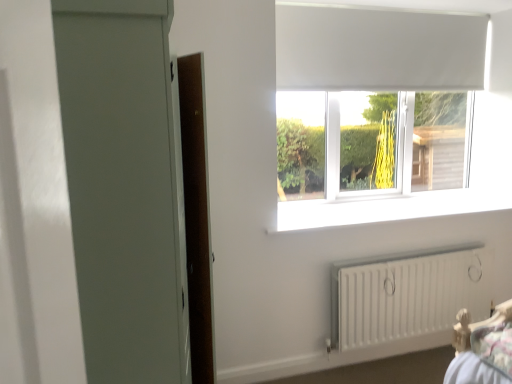
What do you see at coordinates (407, 295) in the screenshot?
I see `white matte radiator at lower right` at bounding box center [407, 295].

Describe the element at coordinates (378, 49) in the screenshot. I see `white matte curtain at upper center` at that location.

This screenshot has height=384, width=512. What do you see at coordinates (389, 208) in the screenshot? I see `white smooth window sill at center` at bounding box center [389, 208].

Where is `matte gray screen door at left`? The image size is (512, 384). matte gray screen door at left is located at coordinates (123, 187).

From a real-world perspective, does white matte curtain at upper center sit lower than matte gray screen door at left?

No, from a real-world perspective, white matte curtain at upper center is not below matte gray screen door at left.

Measure the distance from white matte curtain at upper center to matte gray screen door at left.

1.85 meters.

Find the location of a particular element. This screenshot has width=512, height=384. screen door on the left of the white matte curtain at upper center is located at coordinates (123, 187).

Between matte gray screen door at left and white matte radiator at lower right, which one has smaller width?

white matte radiator at lower right is thinner.

Is matte gray screen door at left to the left or to the right of white matte radiator at lower right in the image?

Based on their positions, matte gray screen door at left is located to the left of white matte radiator at lower right.

Can you tell me how much matte gray screen door at left and white matte radiator at lower right differ in facing direction?

matte gray screen door at left and white matte radiator at lower right are facing 88.4 degrees away from each other.

Are matte gray screen door at left and white matte radiator at lower right located far from each other?

matte gray screen door at left is far away from white matte radiator at lower right.

Which object is closer to the camera, white matte window at upper center or white smooth window sill at center?

→ white smooth window sill at center is closer to the camera.

The height and width of the screenshot is (384, 512). What are the coordinates of `window sill that appears in front of the white matte window at upper center` in the screenshot? It's located at (389, 208).

Based on their positions, is white matte window at upper center located to the left or right of white smooth window sill at center?

From the image, it's evident that white matte window at upper center is to the left of white smooth window sill at center.

Between matte gray screen door at left and white smooth window sill at center, which one appears on the left side from the viewer's perspective?

Positioned to the left is matte gray screen door at left.

Considering the relative sizes of matte gray screen door at left and white smooth window sill at center in the image provided, is matte gray screen door at left thinner than white smooth window sill at center?

Incorrect, the width of matte gray screen door at left is not less than that of white smooth window sill at center.

Between matte gray screen door at left and white smooth window sill at center, which one has smaller size?

white smooth window sill at center is smaller.

From the image's perspective, between matte gray screen door at left and white smooth window sill at center, who is located below?

matte gray screen door at left, from the image's perspective.

The width and height of the screenshot is (512, 384). I want to click on window sill on the right side of white matte window at upper center, so click(x=389, y=208).

From the image's perspective, between white smooth window sill at center and white matte window at upper center, who is located below?

white smooth window sill at center is shown below in the image.

Is white smooth window sill at center in contact with white matte window at upper center?

No.

Can you confirm if white smooth window sill at center is thinner than white matte window at upper center?

No.

Is white matte radiator at lower right facing away from matte gray screen door at left?

No, matte gray screen door at left is not at the back of white matte radiator at lower right.

Is white matte radiator at lower right next to matte gray screen door at left and touching it?

They are not placed beside each other.

Considering the sizes of white matte radiator at lower right and matte gray screen door at left in the image, is white matte radiator at lower right wider or thinner than matte gray screen door at left?

white matte radiator at lower right is thinner than matte gray screen door at left.

Visually, is white matte curtain at upper center positioned to the left or to the right of white matte window at upper center?

white matte curtain at upper center is positioned on white matte window at upper center's right side.

Can you see white matte curtain at upper center touching white matte window at upper center?

white matte curtain at upper center is not next to white matte window at upper center, and they're not touching.

Based on the photo, does white matte curtain at upper center have a greater width compared to white matte window at upper center?

Yes, white matte curtain at upper center is wider than white matte window at upper center.

In order to click on curtain on the right of the matte gray screen door at left in this screenshot , I will do `click(378, 49)`.

Image resolution: width=512 pixels, height=384 pixels. In order to click on screen door in front of the white matte radiator at lower right in this screenshot , I will do `click(123, 187)`.

From the picture: Estimate the real-world distances between objects in this image. Which object is further from matte gray screen door at left, white matte window at upper center or white matte radiator at lower right?

white matte window at upper center is positioned further to the anchor matte gray screen door at left.

Estimate the real-world distances between objects in this image. Which object is further from white smooth window sill at center, matte gray screen door at left or white matte window at upper center?

The object further to white smooth window sill at center is matte gray screen door at left.

Based on their spatial positions, is white smooth window sill at center or white matte curtain at upper center further from matte gray screen door at left?

white matte curtain at upper center is further to matte gray screen door at left.

Estimate the real-world distances between objects in this image. Which object is closer to white matte curtain at upper center, white smooth window sill at center or white matte window at upper center?

Among the two, white matte window at upper center is located nearer to white matte curtain at upper center.

Estimate the real-world distances between objects in this image. Which object is closer to white matte radiator at lower right, white matte window at upper center or matte gray screen door at left?

Based on the image, white matte window at upper center appears to be nearer to white matte radiator at lower right.

Considering their positions, is white matte curtain at upper center positioned closer to matte gray screen door at left than white smooth window sill at center?

white smooth window sill at center is positioned closer to the anchor matte gray screen door at left.

Looking at the image, which one is located closer to white smooth window sill at center, matte gray screen door at left or white matte curtain at upper center?

Among the two, white matte curtain at upper center is located nearer to white smooth window sill at center.

Which object lies nearer to the anchor point white smooth window sill at center, white matte window at upper center or white matte curtain at upper center?

white matte window at upper center lies closer to white smooth window sill at center than the other object.

Where is `radiator between matte gray screen door at left and white matte curtain at upper center from front to back`? The height and width of the screenshot is (384, 512). radiator between matte gray screen door at left and white matte curtain at upper center from front to back is located at coordinates (407, 295).

Image resolution: width=512 pixels, height=384 pixels. What are the coordinates of `window sill between white matte curtain at upper center and white matte radiator at lower right vertically` in the screenshot? It's located at (389, 208).

What are the coordinates of `window sill positioned between matte gray screen door at left and white matte curtain at upper center from near to far` in the screenshot? It's located at (389, 208).

Identify the location of window sill positioned between matte gray screen door at left and white matte window at upper center from near to far. The height and width of the screenshot is (384, 512). (389, 208).